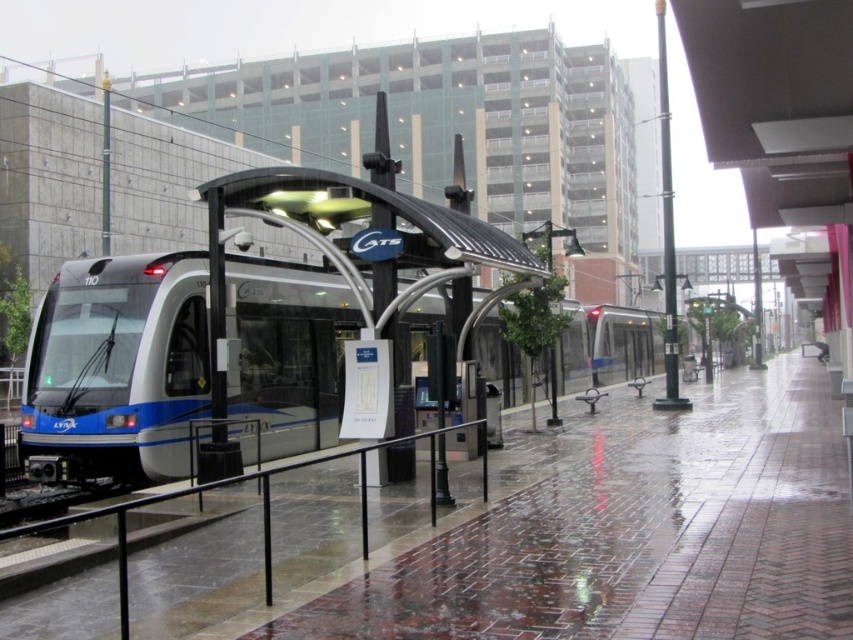
You are standing on the platform at the CATS station. You see the metallic blue train at left. If you face the train and walk straight ahead, will you eventually reach the end of the platform?

The metallic blue train at left is located at point (119, 365) in the scene. Since platforms typically extend beyond the train to allow passengers to board safely, walking straight ahead from the train would lead you toward the end of the platform.